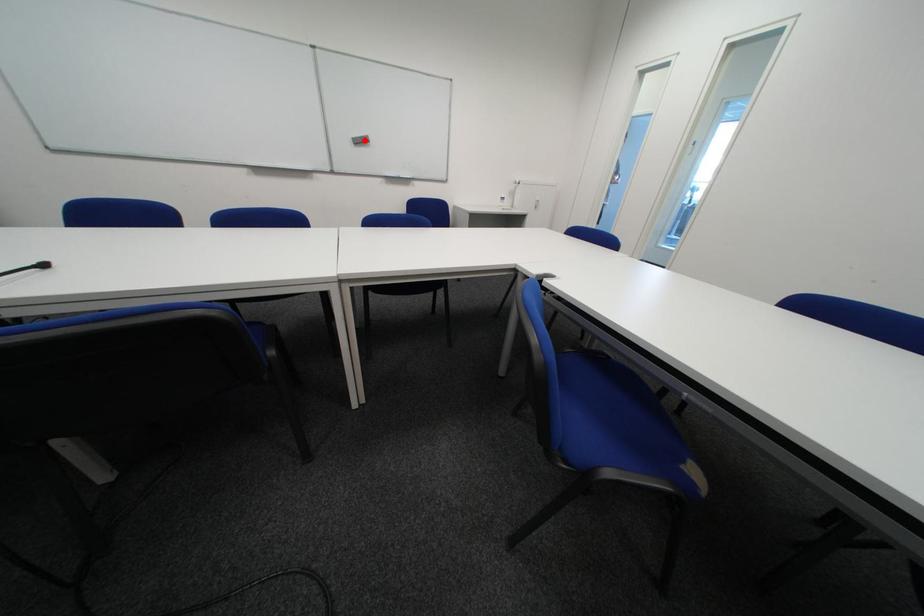
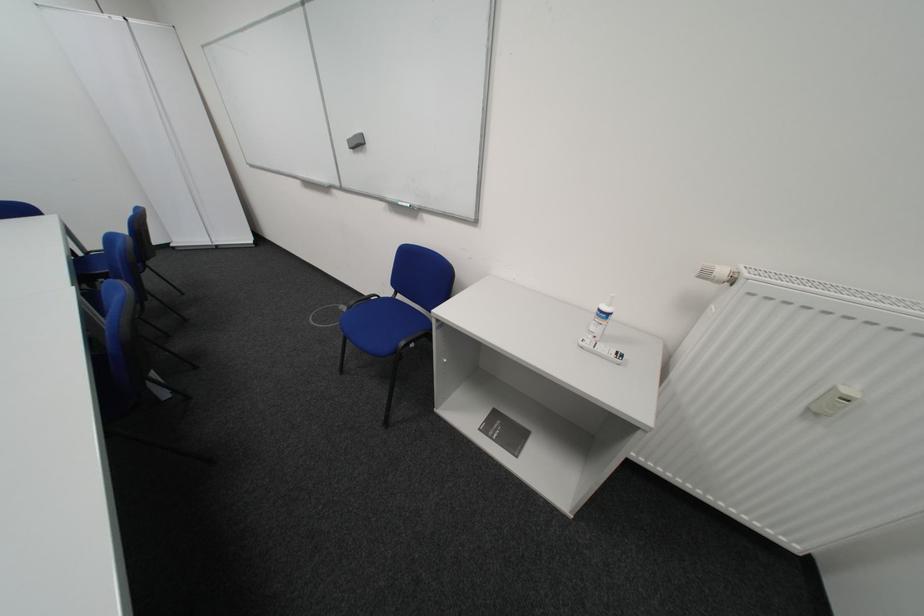
Question: I am providing you with two images of the same scene from different viewpoints. A red point is marked on the first image. Is the red point's position out of view in image 2?

Choices:
 (A) Yes
 (B) No

Answer: (B)